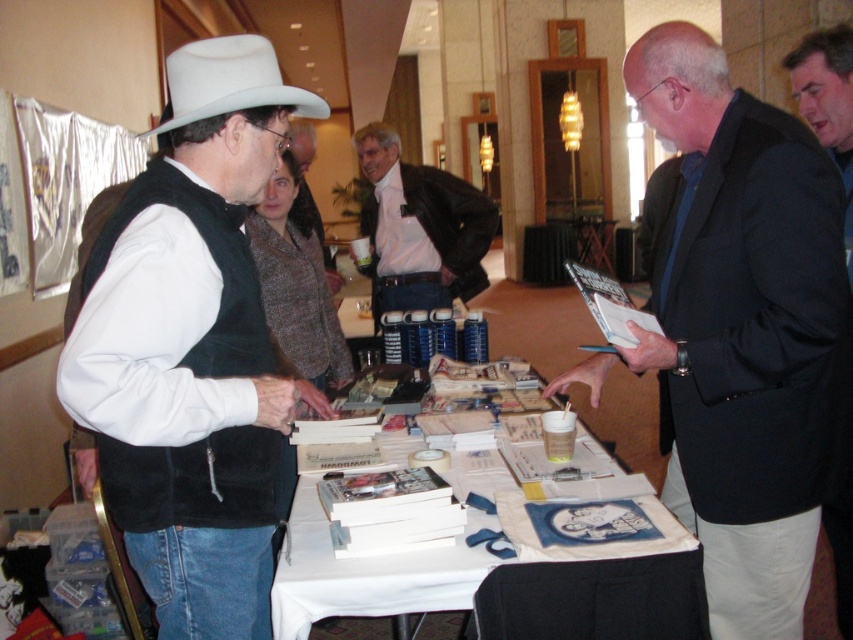
In the scene shown: What is the color of the shirt worn by the person at the coordinates point (421, 228) in the image?

The person at point (421, 228) is wearing a pink shirt.

You are standing at the entrance of the event and want to approach the white paper table at center and the matte brown vest at center. Which object will you encounter first as you move towards them?

You will encounter the white paper table at center first because it is closer to you than the matte brown vest at center.

You are attending a book signing event and see the white paper table at center and the matte brown vest at center. Which object is positioned to the right of the other?

The white paper table at center is to the right of the matte brown vest at center.